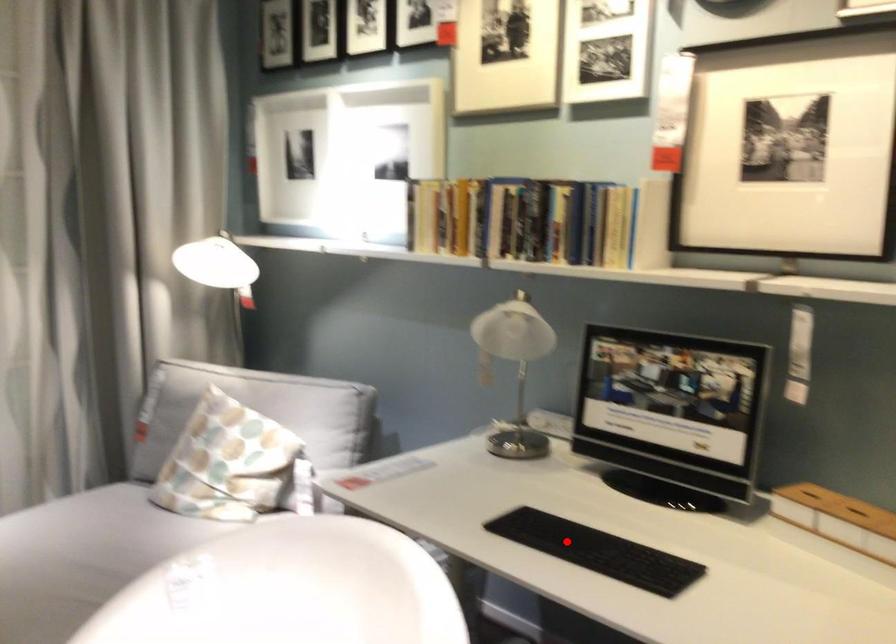
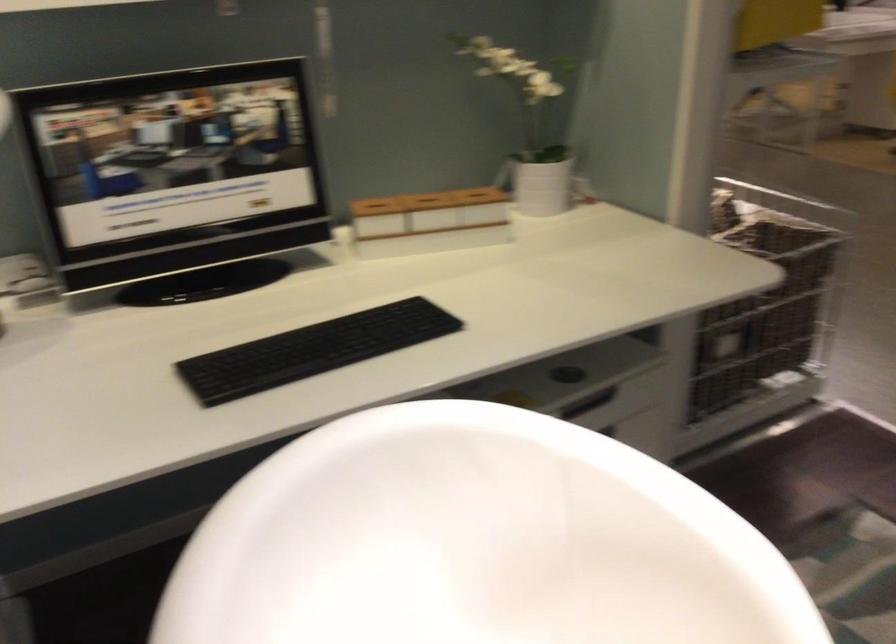
Question: I am providing you with two images of the same scene from different viewpoints. A red point is shown in image1. For the corresponding object point in image2, is it positioned nearer or farther from the camera?

Choices:
 (A) Nearer
 (B) Farther

Answer: (A)